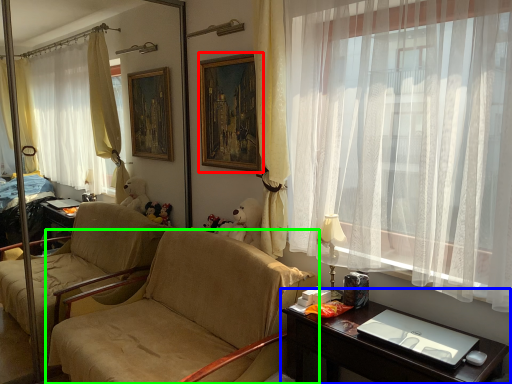
Question: Based on their relative distances, which object is nearer to picture frame (highlighted by a red box)? Choose from desk (highlighted by a blue box) and chair (highlighted by a green box).

Choices:
 (A) desk
 (B) chair

Answer: (B)